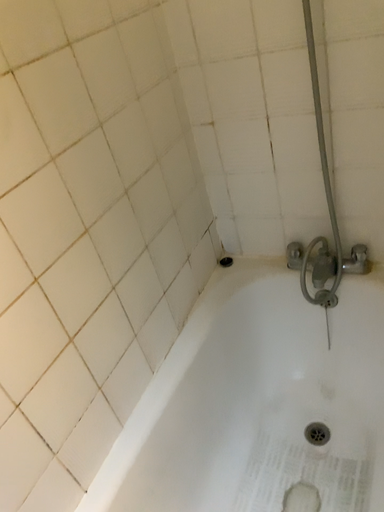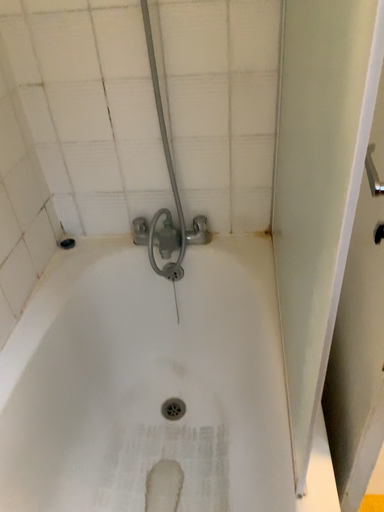
Question: How did the camera likely rotate when shooting the video?

Choices:
 (A) rotated left
 (B) rotated right

Answer: (B)